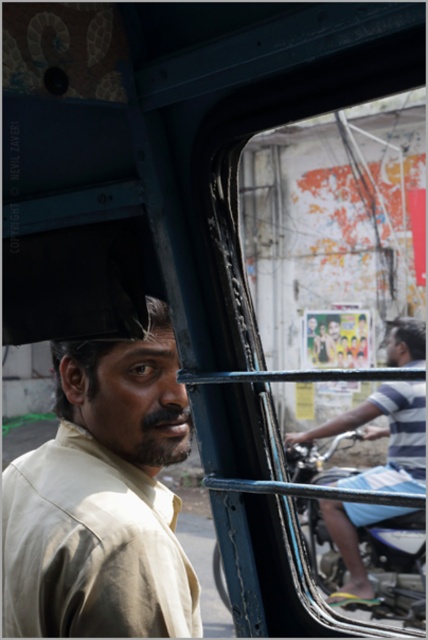
Question: Which object appears closest to the camera in this image?

Choices:
 (A) beige fabric shirt at left
 (B) striped fabric shirt at right

Answer: (A)

Question: Which object is farther from the camera taking this photo?

Choices:
 (A) beige fabric shirt at left
 (B) striped fabric shirt at right

Answer: (B)

Question: Is beige fabric shirt at left below striped fabric shirt at right?

Choices:
 (A) yes
 (B) no

Answer: (B)

Question: Does beige fabric shirt at left appear under striped fabric shirt at right?

Choices:
 (A) no
 (B) yes

Answer: (A)

Question: Observing the image, what is the correct spatial positioning of beige fabric shirt at left in reference to striped fabric shirt at right?

Choices:
 (A) right
 (B) left

Answer: (B)